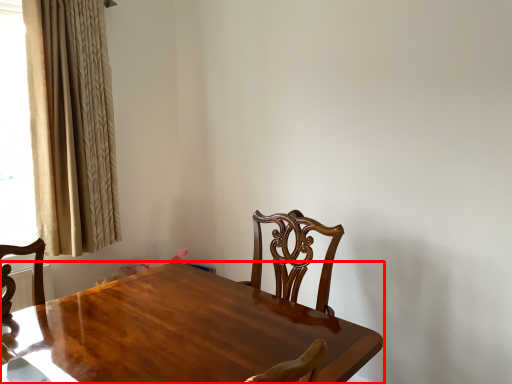
Question: In this image, where is table (annotated by the red box) located relative to curtain?

Choices:
 (A) left
 (B) right

Answer: (B)